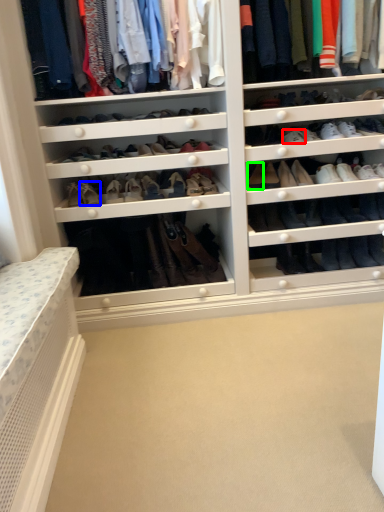
Question: Which object is the farthest from shoe (highlighted by a red box)? Choose among these: shoe (highlighted by a blue box) or shoe (highlighted by a green box).

Choices:
 (A) shoe
 (B) shoe

Answer: (A)